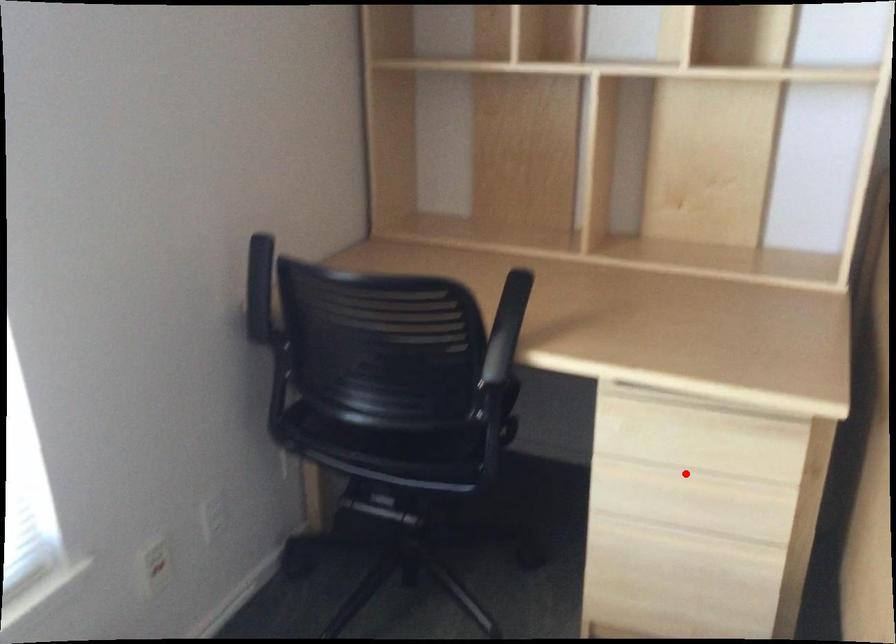
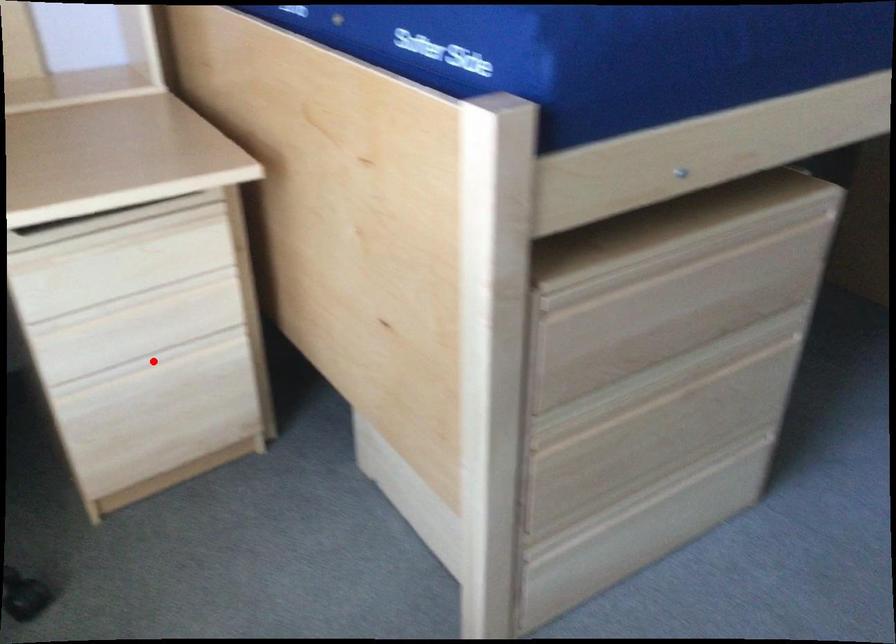
I am providing you with two images of the same scene from different viewpoints. A red point is marked on the first image and another point is marked on the second image. Does the point marked in image1 correspond to the same location as the one in image2?

No